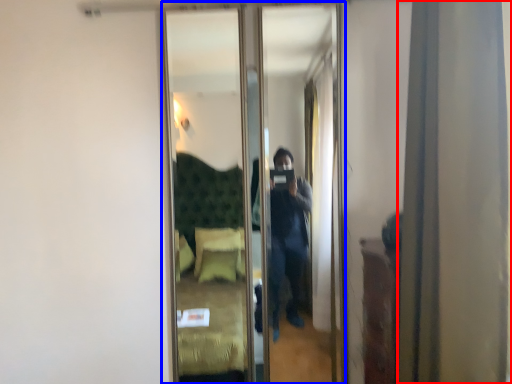
Question: Which of the following is the closest to the observer, curtain (highlighted by a red box) or mirror (highlighted by a blue box)?

Choices:
 (A) curtain
 (B) mirror

Answer: (A)